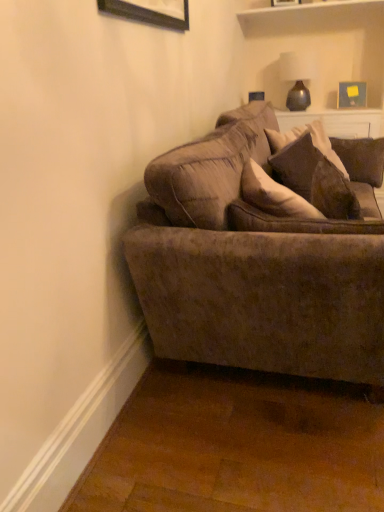
Question: Looking at the image, does wooden picture frame at upper center, positioned as the 1th picture frame in left-to-right order, seem bigger or smaller compared to wooden picture frame at upper right, which appears as the 1th picture frame when viewed from the back?

Choices:
 (A) small
 (B) big

Answer: (A)

Question: Considering the positions of wooden picture frame at upper center, placed as the 2th picture frame when sorted from back to front, and wooden picture frame at upper right, which is the 2th picture frame in front-to-back order, in the image, is wooden picture frame at upper center, placed as the 2th picture frame when sorted from back to front, wider or thinner than wooden picture frame at upper right, which is the 2th picture frame in front-to-back order,?

Choices:
 (A) thin
 (B) wide

Answer: (A)

Question: Estimate the real-world distances between objects in this image. Which object is closer to the velvet brown pillow at upper right?

Choices:
 (A) velvet brown couch at center
 (B) matte brown vase at upper right
 (C) wooden picture frame at upper center, positioned as the 1th picture frame in left-to-right order
 (D) wooden picture frame at upper right, which is the 2th picture frame in front-to-back order

Answer: (A)

Question: Which of these objects is positioned farthest from the velvet brown pillow at upper right?

Choices:
 (A) matte brown vase at upper right
 (B) wooden picture frame at upper right, the 1th picture frame viewed from the right
 (C) wooden picture frame at upper center, which ranks as the first picture frame in top-to-bottom order
 (D) velvet brown couch at center

Answer: (C)